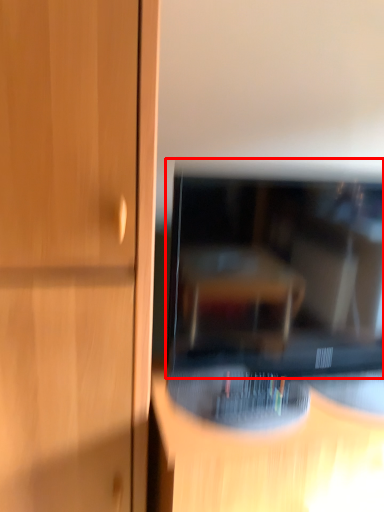
Question: From the image, what is the correct spatial relationship of television (annotated by the red box) in relation to furniture?

Choices:
 (A) right
 (B) left

Answer: (B)